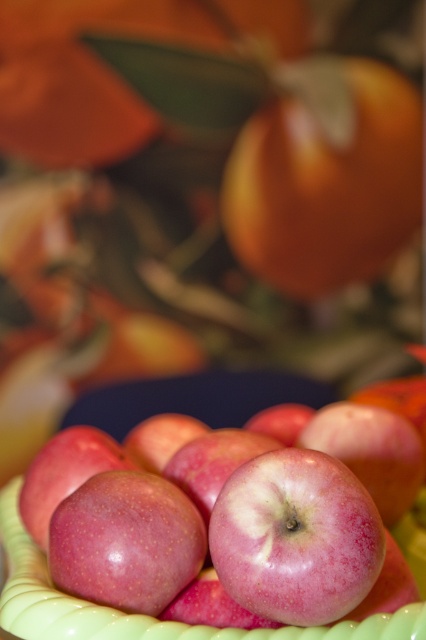
You are an apple picker trying to locate the glossy red apple at center in the basket. Based on the coordinates provided, where exactly would you look to find it?

The glossy red apple at center is located at the 2D coordinates point (226, 515) in the basket.

You are packing a lunchbox and want to fit both the orange matte tangerine at upper right and the pink glossy apple at center. Which fruit should you place first to ensure both fit properly?

The orange matte tangerine at upper right is larger than the pink glossy apple at center, so you should place the orange matte tangerine at upper right first to ensure both fit properly.